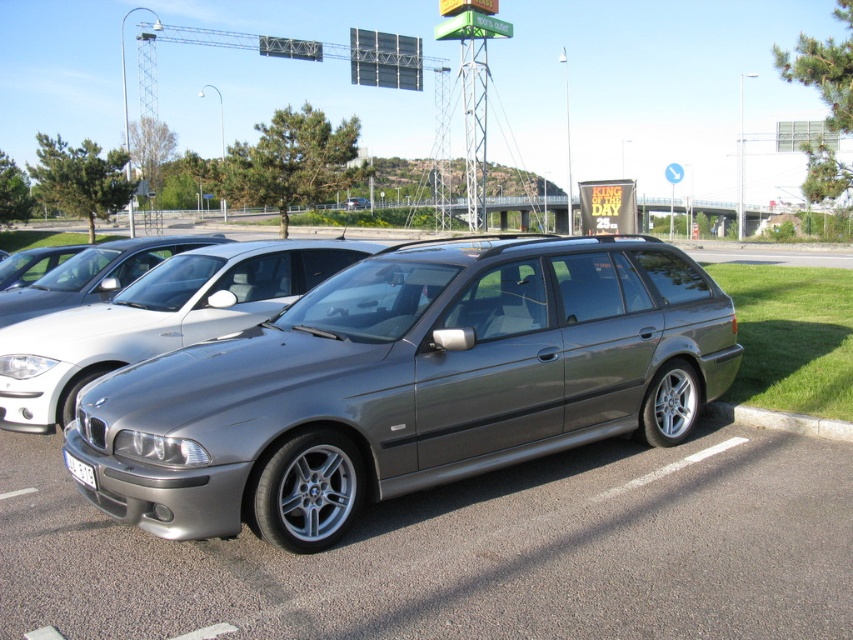
From the picture: You are driving a truck that is 2 meters tall. You need to pass under the bridge shown in the scene. Based on the height of the satin metallic sedan at center and the gray concrete curb at lower right, can you estimate if your truck will clear the bridge?

The satin metallic sedan at center is much taller than the gray concrete curb at lower right. Since the truck is 2 meters tall, if the sedan can pass under the bridge without issue, the truck might be too tall. However, without exact measurements, it is uncertain. Proceed with caution.

You are standing at the edge of the parking lot and want to cross to the other side. There is a satin metallic sedan at center in your path. If your stride length is 0.75 meters, how many steps do you need to take to walk around the sedan and reach the other side of the parking lot?

The satin metallic sedan at center is 3.85 meters away from you. To walk around it, you need to cover approximately 3.85 meters divided by your stride length of 0.75 meters per step, which equals about 5.13 steps. Since you can only take whole steps, you would need to take 6 steps to safely navigate around the sedan and reach the other side of the parking lot.